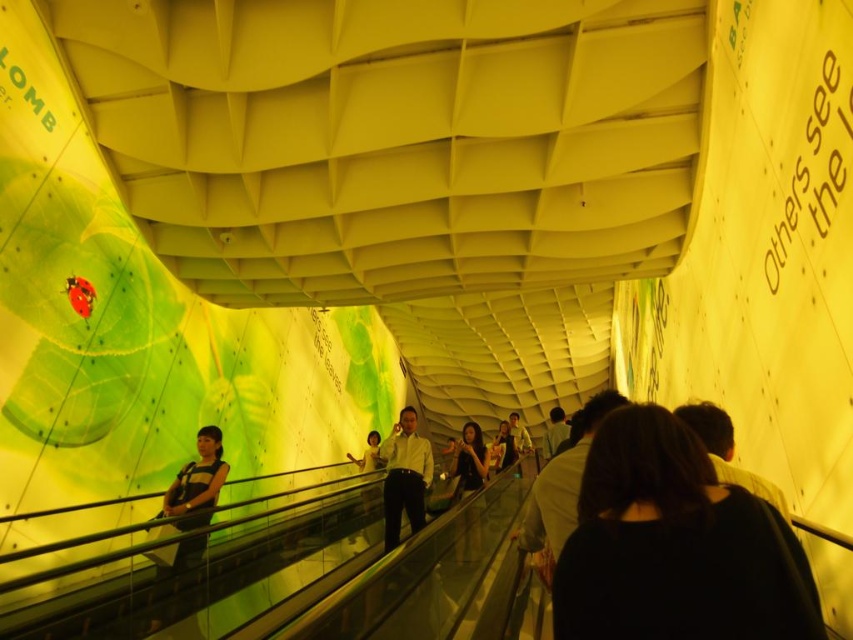
Between point (741, 598) and point (480, 436), which one is positioned behind?

Positioned behind is point (480, 436).

Between point (663, 508) and point (474, 525), which one is positioned behind?

Positioned behind is point (474, 525).

Where is `black hair at center`? This screenshot has width=853, height=640. black hair at center is located at coordinates (675, 545).

Which of these two, light brown shirt at center or matte black shirt at center, stands taller?

matte black shirt at center

Between point (387, 492) and point (461, 554), which one is positioned behind?

The point (387, 492) is more distant.

What do you see at coordinates (404, 476) in the screenshot?
I see `light brown shirt at center` at bounding box center [404, 476].

In order to click on light brown shirt at center in this screenshot , I will do `click(404, 476)`.

From the picture: Who is more forward, (640, 529) or (392, 454)?

Point (640, 529) is more forward.

Where is `black hair at center`? Image resolution: width=853 pixels, height=640 pixels. black hair at center is located at coordinates 675,545.